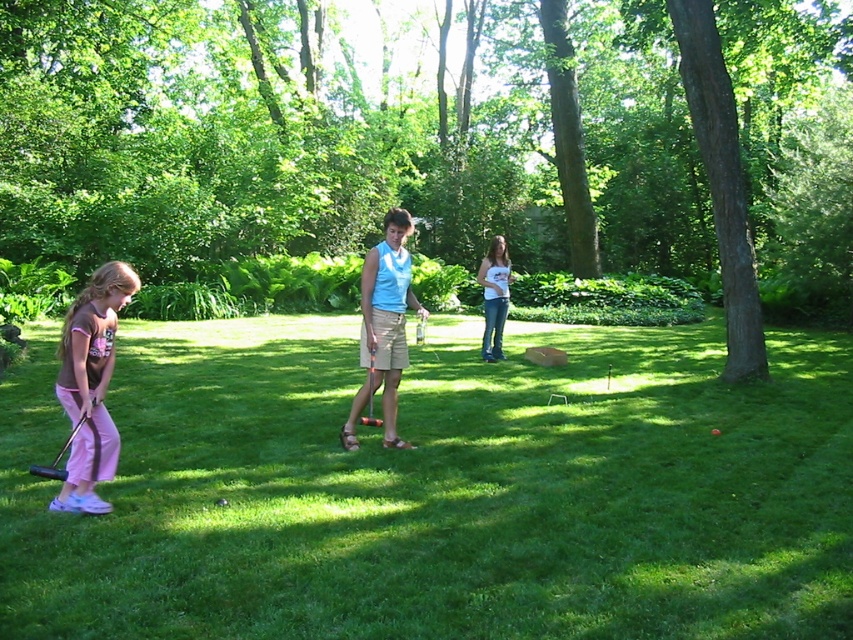
Question: Does green grass at center appear on the left side of light blue fabric shirt at center?

Choices:
 (A) yes
 (B) no

Answer: (A)

Question: Can you confirm if matte pink pants at left is thinner than white cotton shirt at center?

Choices:
 (A) no
 (B) yes

Answer: (B)

Question: Which of the following is the farthest from the observer?

Choices:
 (A) (363, 353)
 (B) (490, 280)

Answer: (B)

Question: Does green grass at center appear over light blue fabric shirt at center?

Choices:
 (A) yes
 (B) no

Answer: (B)

Question: Which point is farther to the camera?

Choices:
 (A) click(x=399, y=244)
 (B) click(x=112, y=433)

Answer: (A)

Question: Which point is farther from the camera taking this photo?

Choices:
 (A) (367, 276)
 (B) (503, 253)
 (C) (70, 353)

Answer: (B)